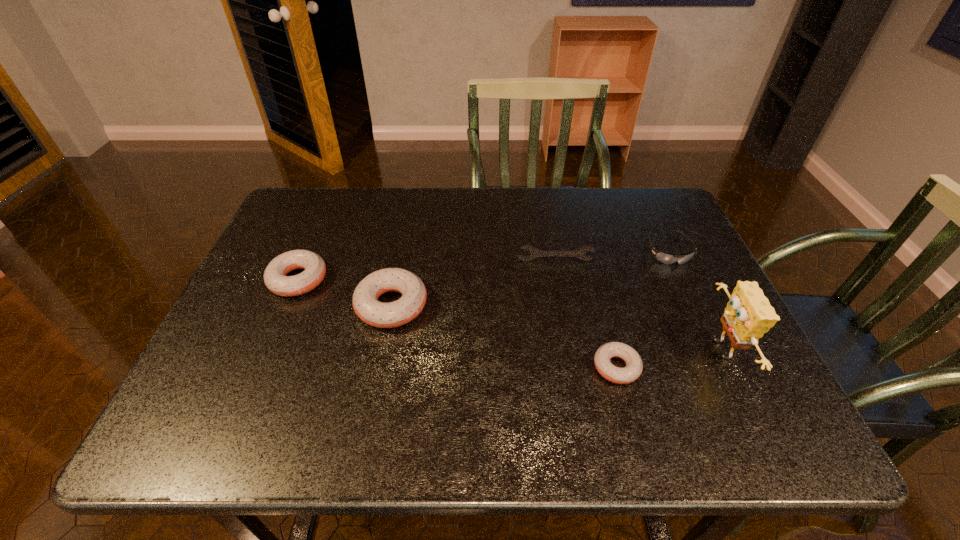
The image size is (960, 540). Identify the location of the leftmost object. (275, 278).

Image resolution: width=960 pixels, height=540 pixels. I want to click on the second tallest doughnut, so click(x=275, y=278).

This screenshot has width=960, height=540. I want to click on the second doughnut from left to right, so click(x=365, y=301).

Identify the location of the nearest doughnut. (634, 366).

Where is `the rightmost doughnut`? the rightmost doughnut is located at coordinates tap(634, 366).

You are a GUI agent. You are given a task and a screenshot of the screen. Output one action in this format:
    pyautogui.click(x=<x>, y=<y>)
    Task: Click on the sunglasses
    This screenshot has height=540, width=960.
    Given the screenshot: What is the action you would take?
    (664, 258)

Image resolution: width=960 pixels, height=540 pixels. I want to click on wrench, so click(535, 253).

The image size is (960, 540). I want to click on the tallest object, so click(748, 315).

The image size is (960, 540). I want to click on free space located on the front of the leftmost doughnut, so click(265, 359).

This screenshot has width=960, height=540. I want to click on vacant space located 0.120m on the back of the second doughnut from left to right, so click(x=402, y=249).